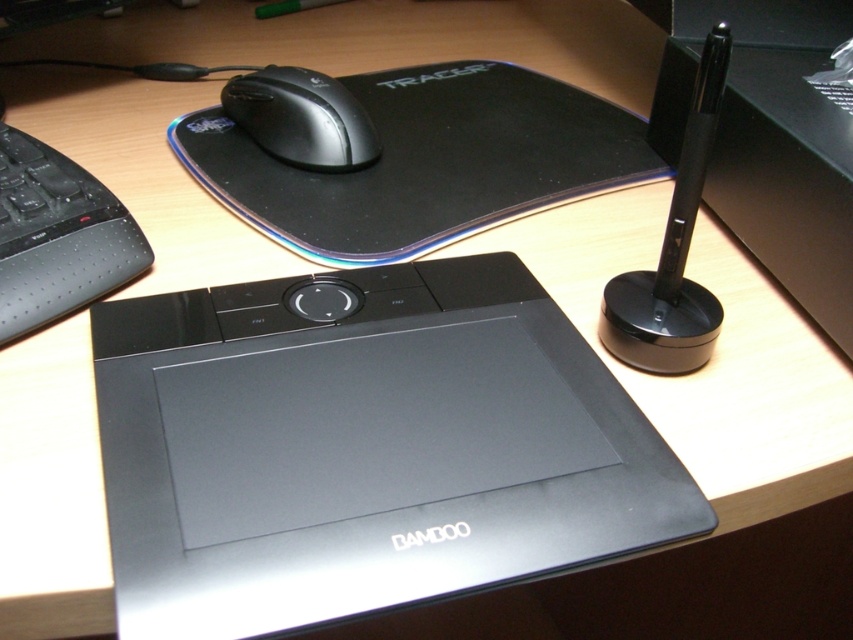
Question: Can you confirm if black rubber mousepad at upper center is wider than matte black mouse at upper center?

Choices:
 (A) no
 (B) yes

Answer: (B)

Question: Which is nearer to the black matte keyboard at left?

Choices:
 (A) black rubber mousepad at upper center
 (B) matte black tablet at center

Answer: (B)

Question: Estimate the real-world distances between objects in this image. Which object is farther from the matte black mouse at upper center?

Choices:
 (A) matte black tablet at center
 (B) black rubber mousepad at upper center
 (C) black matte keyboard at left

Answer: (A)

Question: Which is farther from the black rubber mousepad at upper center?

Choices:
 (A) matte black tablet at center
 (B) matte black mouse at upper center

Answer: (A)

Question: Considering the relative positions of black matte keyboard at left and matte black mouse at upper center in the image provided, where is black matte keyboard at left located with respect to matte black mouse at upper center?

Choices:
 (A) left
 (B) right

Answer: (A)

Question: Observing the image, what is the correct spatial positioning of black rubber mousepad at upper center in reference to matte black mouse at upper center?

Choices:
 (A) right
 (B) left

Answer: (A)